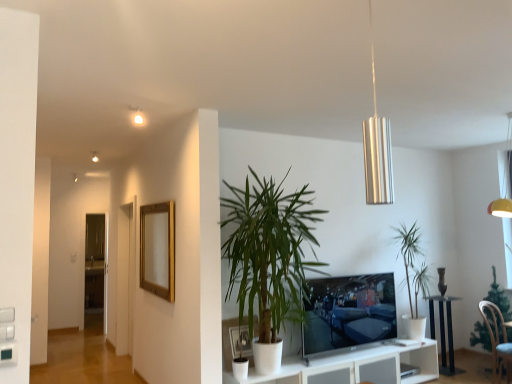
Question: Does transparent glass door at left turn towards green leafy plant at center, positioned as the third houseplant in right-to-left order?

Choices:
 (A) yes
 (B) no

Answer: (A)

Question: Is transparent glass door at left completely or partially outside of green leafy plant at center, positioned as the third houseplant in right-to-left order?

Choices:
 (A) no
 (B) yes

Answer: (B)

Question: Is transparent glass door at left next to green leafy plant at center, positioned as the third houseplant in right-to-left order?

Choices:
 (A) yes
 (B) no

Answer: (B)

Question: Considering the relative positions of transparent glass door at left and green leafy plant at center, which appears as the first houseplant when viewed from the left, in the image provided, is transparent glass door at left in front of green leafy plant at center, which appears as the first houseplant when viewed from the left,?

Choices:
 (A) yes
 (B) no

Answer: (B)

Question: From a real-world perspective, is transparent glass door at left physically below green leafy plant at center, which appears as the first houseplant when viewed from the left?

Choices:
 (A) no
 (B) yes

Answer: (B)

Question: Can you confirm if transparent glass door at left is taller than green leafy plant at center, which appears as the first houseplant when viewed from the left?

Choices:
 (A) no
 (B) yes

Answer: (B)

Question: Is flat screen tv at center oriented away from gold wooden picture frame at upper left, marked as the first picture frame in a back-to-front arrangement?

Choices:
 (A) no
 (B) yes

Answer: (A)

Question: Considering the relative sizes of flat screen tv at center and gold wooden picture frame at upper left, positioned as the first picture frame in top-to-bottom order, in the image provided, is flat screen tv at center thinner than gold wooden picture frame at upper left, positioned as the first picture frame in top-to-bottom order,?

Choices:
 (A) no
 (B) yes

Answer: (A)

Question: Is flat screen tv at center in front of gold wooden picture frame at upper left, marked as the first picture frame in a back-to-front arrangement?

Choices:
 (A) no
 (B) yes

Answer: (A)

Question: Considering the relative sizes of flat screen tv at center and gold wooden picture frame at upper left, the second picture frame positioned from the bottom, in the image provided, is flat screen tv at center shorter than gold wooden picture frame at upper left, the second picture frame positioned from the bottom,?

Choices:
 (A) yes
 (B) no

Answer: (A)

Question: Is the surface of flat screen tv at center in direct contact with gold wooden picture frame at upper left, the second picture frame positioned from the bottom?

Choices:
 (A) no
 (B) yes

Answer: (A)

Question: Is flat screen tv at center behind gold wooden picture frame at upper left, placed as the first picture frame when sorted from left to right?

Choices:
 (A) no
 (B) yes

Answer: (B)

Question: From a real-world perspective, is gold wooden picture frame at upper left, placed as the first picture frame when sorted from left to right, beneath green leafy plant at lower right, acting as the 3th houseplant starting from the left?

Choices:
 (A) yes
 (B) no

Answer: (B)